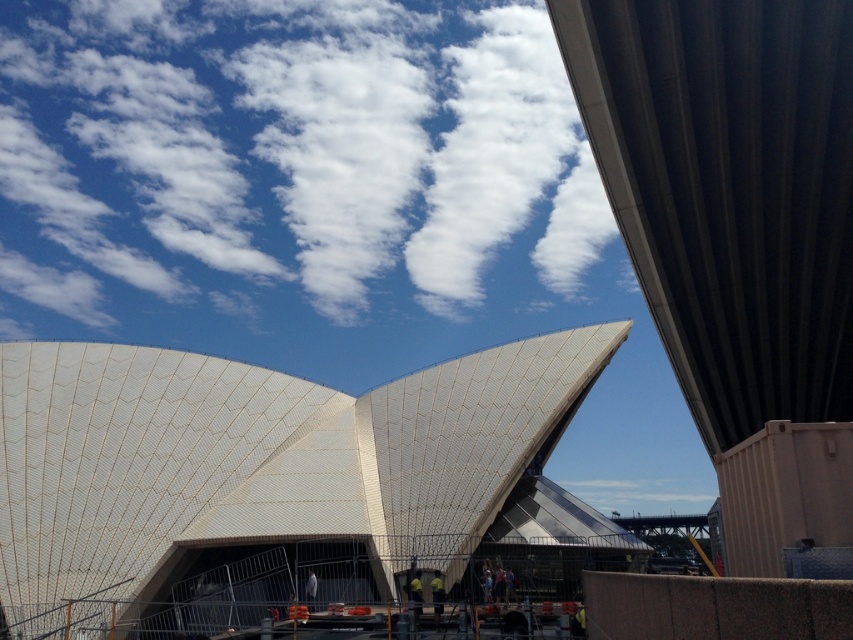
Question: Which object is farther from the camera taking this photo?

Choices:
 (A) white textured roof at center
 (B) yellow fabric construction worker at lower center
 (C) light blue fabric construction worker at lower center
 (D) yellow fabric construction worker at center

Answer: (C)

Question: Does white fluffy cloud at upper center have a smaller size compared to yellow fabric construction worker at lower center?

Choices:
 (A) yes
 (B) no

Answer: (B)

Question: Which object is positioned closest to the white fluffy cloud at upper center?

Choices:
 (A) white textured roof at center
 (B) metallic gray bridge at center
 (C) yellow fabric construction worker at center

Answer: (A)

Question: Estimate the real-world distances between objects in this image. Which object is farther from the metallic gray bridge at center?

Choices:
 (A) light blue fabric construction worker at lower center
 (B) yellow fabric construction worker at lower center
 (C) yellow fabric construction worker at center
 (D) white textured roof at center

Answer: (A)

Question: Is metallic gray bridge at center smaller than yellow fabric construction worker at center?

Choices:
 (A) no
 (B) yes

Answer: (A)

Question: Can you confirm if yellow fabric construction worker at lower center is positioned below light blue fabric construction worker at lower center?

Choices:
 (A) no
 (B) yes

Answer: (A)